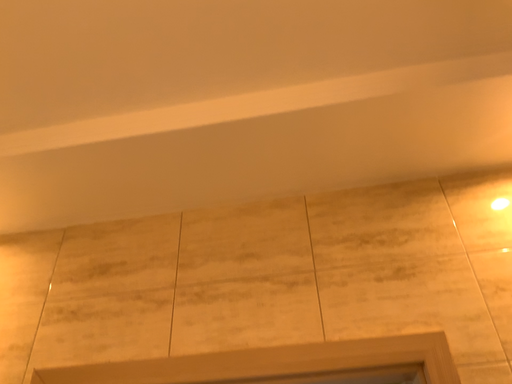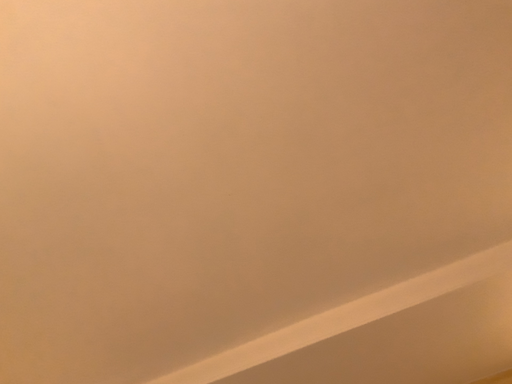
Question: How did the camera likely rotate when shooting the video?

Choices:
 (A) rotated downward
 (B) rotated upward

Answer: (B)